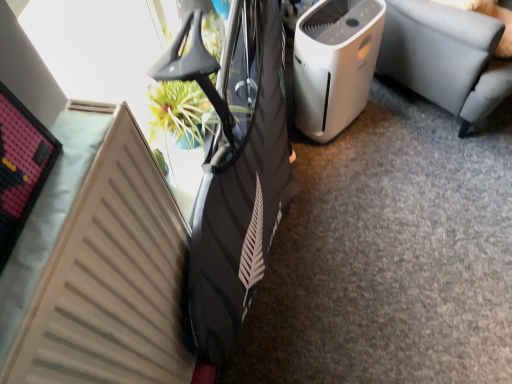
Question: Does beige matte radiator at lower left appear on the left side of white plastic air purifier at center-right?

Choices:
 (A) yes
 (B) no

Answer: (A)

Question: Is white plastic air purifier at center-right located within beige matte radiator at lower left?

Choices:
 (A) yes
 (B) no

Answer: (B)

Question: From the image's perspective, is beige matte radiator at lower left located above white plastic air purifier at center-right?

Choices:
 (A) yes
 (B) no

Answer: (B)

Question: Does beige matte radiator at lower left have a greater width compared to white plastic air purifier at center-right?

Choices:
 (A) yes
 (B) no

Answer: (B)

Question: Considering the relative positions of beige matte radiator at lower left and white plastic air purifier at center-right in the image provided, is beige matte radiator at lower left in front of white plastic air purifier at center-right?

Choices:
 (A) yes
 (B) no

Answer: (A)

Question: Is white plastic air purifier at center-right situated inside beige matte radiator at lower left or outside?

Choices:
 (A) outside
 (B) inside

Answer: (A)

Question: In terms of width, does white plastic air purifier at center-right look wider or thinner when compared to beige matte radiator at lower left?

Choices:
 (A) thin
 (B) wide

Answer: (B)

Question: From their relative heights in the image, would you say white plastic air purifier at center-right is taller or shorter than beige matte radiator at lower left?

Choices:
 (A) tall
 (B) short

Answer: (B)

Question: From a real-world perspective, is white plastic air purifier at center-right positioned above or below beige matte radiator at lower left?

Choices:
 (A) above
 (B) below

Answer: (B)

Question: Considering the positions of white plastic air purifier at center right and white plastic air purifier at center-right in the image, is white plastic air purifier at center right wider or thinner than white plastic air purifier at center-right?

Choices:
 (A) wide
 (B) thin

Answer: (A)

Question: Would you say white plastic air purifier at center right is to the left or to the right of white plastic air purifier at center-right in the picture?

Choices:
 (A) right
 (B) left

Answer: (A)

Question: From a real-world perspective, is white plastic air purifier at center right positioned above or below white plastic air purifier at center-right?

Choices:
 (A) above
 (B) below

Answer: (A)

Question: Is point tap(506, 82) positioned closer to the camera than point tap(305, 46)?

Choices:
 (A) farther
 (B) closer

Answer: (B)

Question: Considering the positions of point (49, 357) and point (328, 44), is point (49, 357) closer or farther from the camera than point (328, 44)?

Choices:
 (A) farther
 (B) closer

Answer: (B)

Question: From the image's perspective, is beige matte radiator at lower left positioned above or below white plastic air purifier at center-right?

Choices:
 (A) above
 (B) below

Answer: (B)